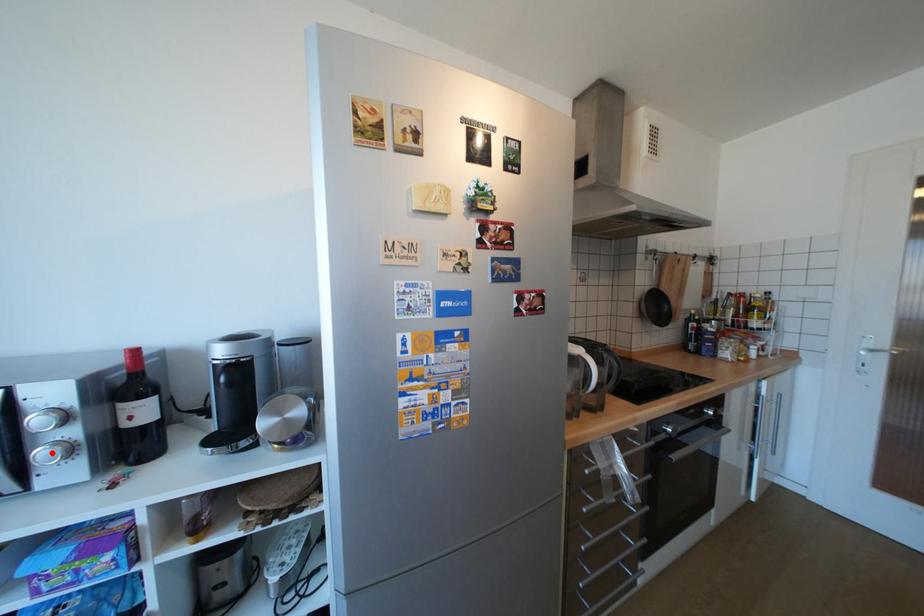
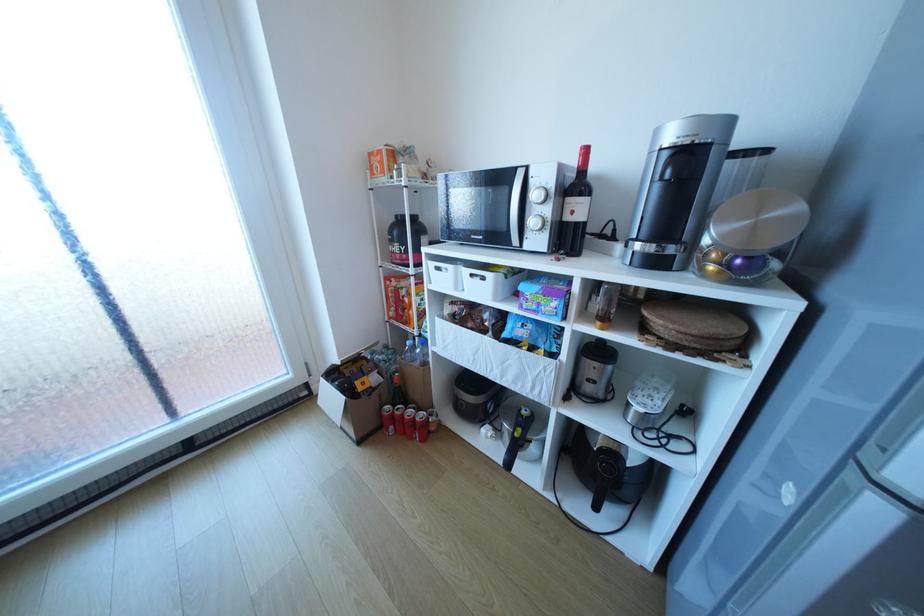
The point at the highlighted location is marked in the first image. Where is the corresponding point in the second image?

(541, 222)